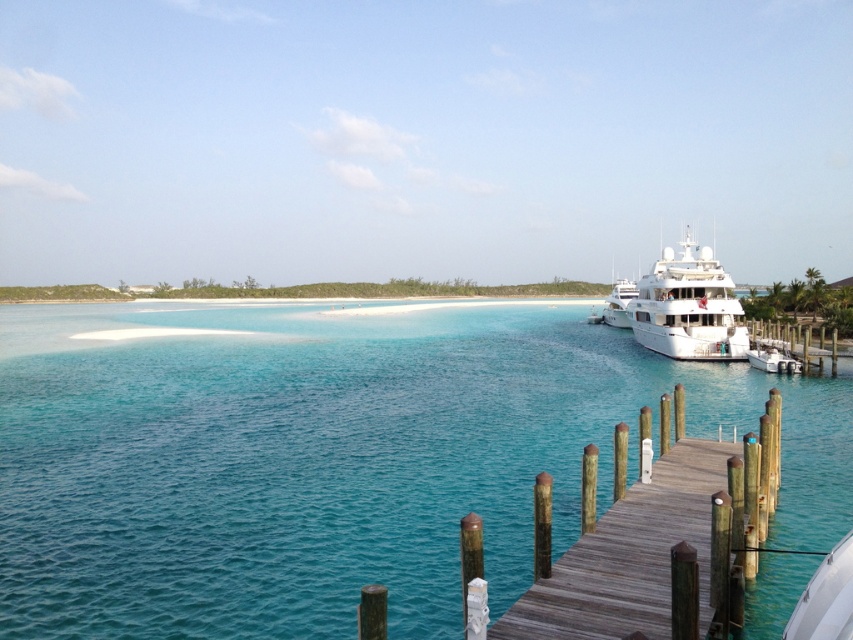
Question: Which of these objects is positioned closest to the turquoise water at center?

Choices:
 (A) wooden dock at lower right
 (B) white glossy cruise ship at right

Answer: (B)

Question: Is wooden dock at lower right positioned at the back of white glossy cruise ship at right?

Choices:
 (A) no
 (B) yes

Answer: (A)

Question: Is turquoise water at center bigger than wooden dock at lower right?

Choices:
 (A) no
 (B) yes

Answer: (B)

Question: Among these objects, which one is nearest to the camera?

Choices:
 (A) wooden dock at lower right
 (B) white glossy cruise ship at right

Answer: (A)

Question: Which point is farther to the camera?

Choices:
 (A) white glossy cruise ship at right
 (B) turquoise water at center
 (C) wooden dock at lower right

Answer: (A)

Question: Can you confirm if turquoise water at center is positioned to the right of white glossy cruise ship at right?

Choices:
 (A) yes
 (B) no

Answer: (B)